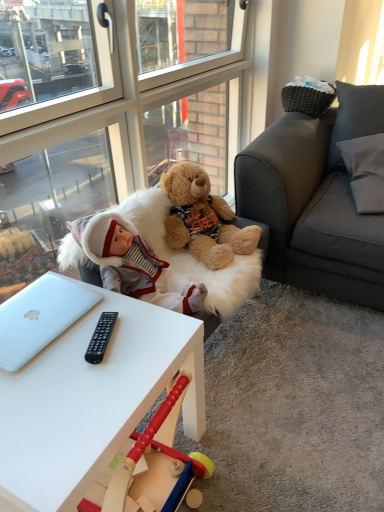
Image resolution: width=384 pixels, height=512 pixels. Identify the location of free point below silver metallic laptop at lower left (from a real-world perspective). (36, 307).